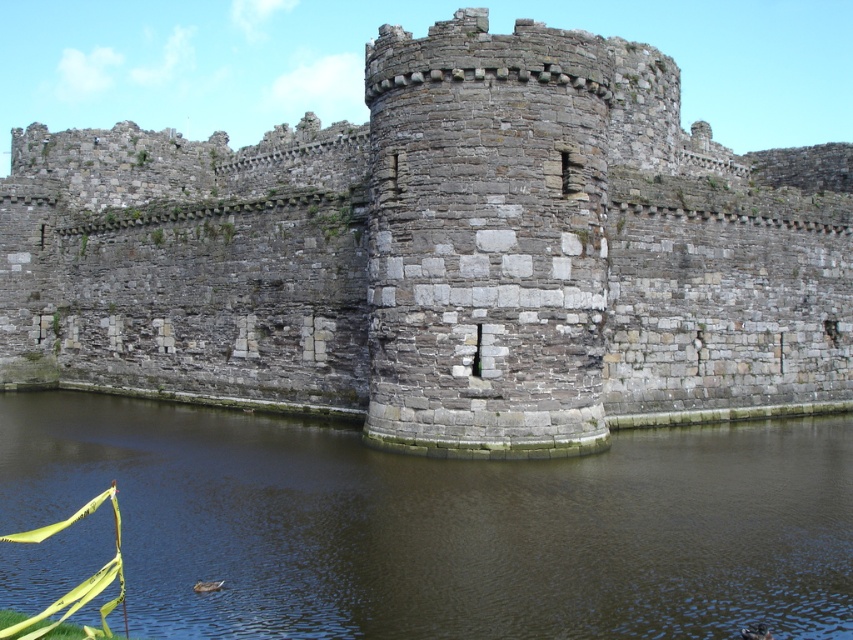
Question: Can you confirm if gray stone wall at center is smaller than brown stone water at center?

Choices:
 (A) yes
 (B) no

Answer: (B)

Question: Which point appears closest to the camera in this image?

Choices:
 (A) (711, 497)
 (B) (486, 298)

Answer: (A)

Question: Does gray stone wall at center have a smaller size compared to brown stone water at center?

Choices:
 (A) no
 (B) yes

Answer: (A)

Question: Can you confirm if gray stone wall at center is positioned above brown stone water at center?

Choices:
 (A) no
 (B) yes

Answer: (B)